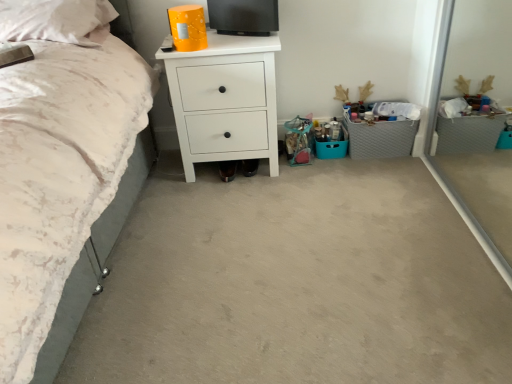
Locate an element on the screen. gray fabric storage at right is located at coordinates (381, 138).

Locate an element on the screen. This screenshot has height=384, width=512. white matte chest of drawers at center is located at coordinates (225, 100).

Where is `gray fabric storage at right`? This screenshot has width=512, height=384. gray fabric storage at right is located at coordinates (381, 138).

The width and height of the screenshot is (512, 384). I want to click on crate on the right of white matte chest of drawers at center, so 381,138.

Considering the points (248, 81) and (379, 157), which point is behind, point (248, 81) or point (379, 157)?

The point (379, 157) is farther.

Is white matte chest of drawers at center oriented towards gray fabric storage at right?

No, white matte chest of drawers at center is not facing towards gray fabric storage at right.

Between white matte chest of drawers at center and gray fabric storage at right, which one is positioned behind?

gray fabric storage at right is more distant.

Is white soft pillow at upper left with gray fabric storage at right?

white soft pillow at upper left and gray fabric storage at right are clearly separated.

Is point (15, 36) closer to camera compared to point (368, 145)?

Yes, point (15, 36) is closer to viewer.

Is white soft pillow at upper left to the left or to the right of gray fabric storage at right in the image?

From the image, it's evident that white soft pillow at upper left is to the left of gray fabric storage at right.

From the image's perspective, is white soft pillow at upper left over gray fabric storage at right?

Yes, from the image's perspective, white soft pillow at upper left is over gray fabric storage at right.

How distant is gray fabric storage at right from white matte chest of drawers at center?

The distance of gray fabric storage at right from white matte chest of drawers at center is 25.79 inches.

From the image's perspective, would you say gray fabric storage at right is shown under white matte chest of drawers at center?

Yes.

Which is in front, point (392, 143) or point (230, 128)?

Positioned in front is point (230, 128).

Is white matte chest of drawers at center surrounded by gray fabric storage at right?

No, white matte chest of drawers at center is located outside of gray fabric storage at right.

Looking at the image, does gray fabric storage at right seem bigger or smaller compared to white soft pillow at upper left?

gray fabric storage at right is smaller than white soft pillow at upper left.

From the image's perspective, which is below, gray fabric storage at right or white soft pillow at upper left?

From the image's view, gray fabric storage at right is below.

Which object is more forward, gray fabric storage at right or white soft pillow at upper left?

white soft pillow at upper left is in front.

In terms of width, does gray fabric storage at right look wider or thinner when compared to white soft pillow at upper left?

In the image, gray fabric storage at right appears to be more narrow than white soft pillow at upper left.

Does white soft pillow at upper left appear on the right side of white matte chest of drawers at center?

In fact, white soft pillow at upper left is to the left of white matte chest of drawers at center.

You are a GUI agent. You are given a task and a screenshot of the screen. Output one action in this format:
    pyautogui.click(x=<x>, y=<y>)
    Task: Click on the pillow on the left of the white matte chest of drawers at center
    The width and height of the screenshot is (512, 384).
    Given the screenshot: What is the action you would take?
    pyautogui.click(x=56, y=20)

Is white soft pillow at upper left spatially inside white matte chest of drawers at center, or outside of it?

white soft pillow at upper left is located beyond the bounds of white matte chest of drawers at center.

Which is behind, white soft pillow at upper left or white matte chest of drawers at center?

white matte chest of drawers at center is further from the camera.

Which is less distant, (192, 163) or (3, 4)?

Point (192, 163).

Measure the distance from white matte chest of drawers at center to white soft pillow at upper left.

white matte chest of drawers at center and white soft pillow at upper left are 21.58 inches apart from each other.

From the image's perspective, is white matte chest of drawers at center under white soft pillow at upper left?

Yes, from the image's perspective, white matte chest of drawers at center is below white soft pillow at upper left.

Is white matte chest of drawers at center inside or outside of white soft pillow at upper left?

white matte chest of drawers at center is spatially situated outside white soft pillow at upper left.

In the image, there is a white matte chest of drawers at center. Where is `crate below it (from a real-world perspective)`? The image size is (512, 384). crate below it (from a real-world perspective) is located at coordinates (381, 138).

The height and width of the screenshot is (384, 512). I want to click on pillow in front of the gray fabric storage at right, so click(x=56, y=20).

Considering their positions, is white matte chest of drawers at center positioned further to gray fabric storage at right than white soft pillow at upper left?

Based on the image, white soft pillow at upper left appears to be further to gray fabric storage at right.

Considering their positions, is gray fabric storage at right positioned further to white matte chest of drawers at center than white soft pillow at upper left?

gray fabric storage at right is further to white matte chest of drawers at center.

When comparing their distances from white soft pillow at upper left, does gray fabric storage at right or white matte chest of drawers at center seem further?

Among the two, gray fabric storage at right is located further to white soft pillow at upper left.

Looking at the image, which one is located closer to gray fabric storage at right, white soft pillow at upper left or white matte chest of drawers at center?

Among the two, white matte chest of drawers at center is located nearer to gray fabric storage at right.

From the image, which object appears to be farther from white soft pillow at upper left, white matte chest of drawers at center or gray fabric storage at right?

gray fabric storage at right is positioned further to the anchor white soft pillow at upper left.

From the image, which object appears to be nearer to white matte chest of drawers at center, white soft pillow at upper left or gray fabric storage at right?

white soft pillow at upper left.

This screenshot has height=384, width=512. Find the location of `chest of drawers between white soft pillow at upper left and gray fabric storage at right`. chest of drawers between white soft pillow at upper left and gray fabric storage at right is located at coordinates (225, 100).